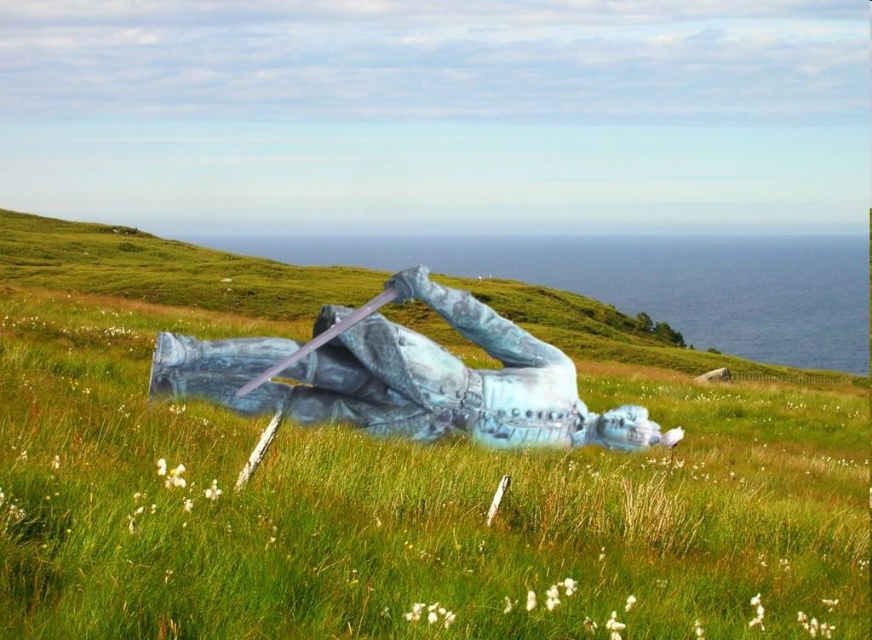
Question: In this image, where is blue metallic statue at center located relative to blue-green metallic statue at center?

Choices:
 (A) left
 (B) right

Answer: (B)

Question: Among these objects, which one is nearest to the camera?

Choices:
 (A) blue-green metallic statue at center
 (B) blue-green stone statue at center
 (C) blue metallic statue at center

Answer: (C)

Question: Can you confirm if blue metallic statue at center is positioned above blue-green metallic statue at center?

Choices:
 (A) yes
 (B) no

Answer: (B)

Question: Which object is closer to the camera taking this photo?

Choices:
 (A) blue metallic statue at center
 (B) blue-green stone statue at center
 (C) blue-green metallic statue at center

Answer: (A)

Question: Estimate the real-world distances between objects in this image. Which object is closer to the blue metallic statue at center?

Choices:
 (A) blue-green metallic statue at center
 (B) blue-green stone statue at center

Answer: (A)

Question: Where is blue-green metallic statue at center located in relation to blue-green stone statue at center in the image?

Choices:
 (A) right
 (B) left

Answer: (A)